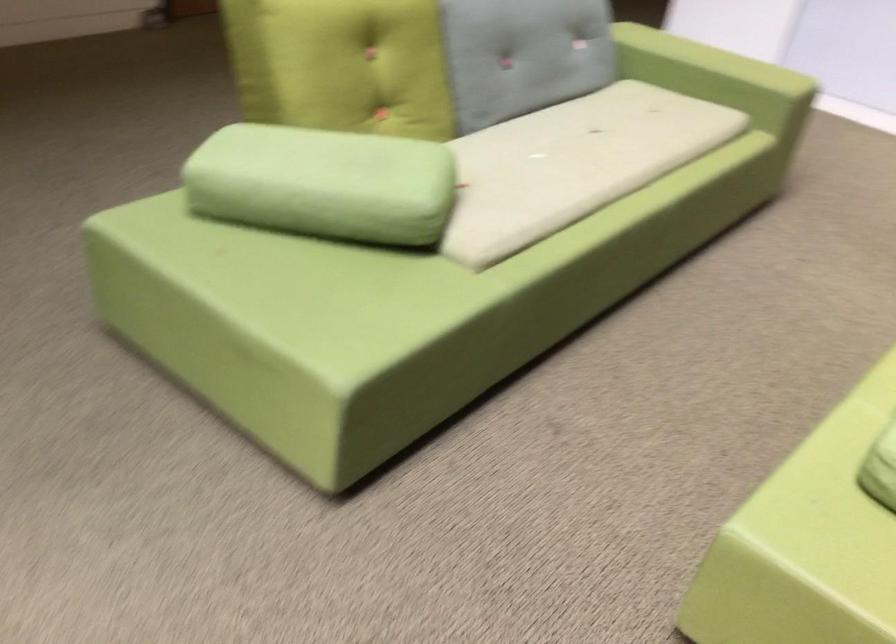
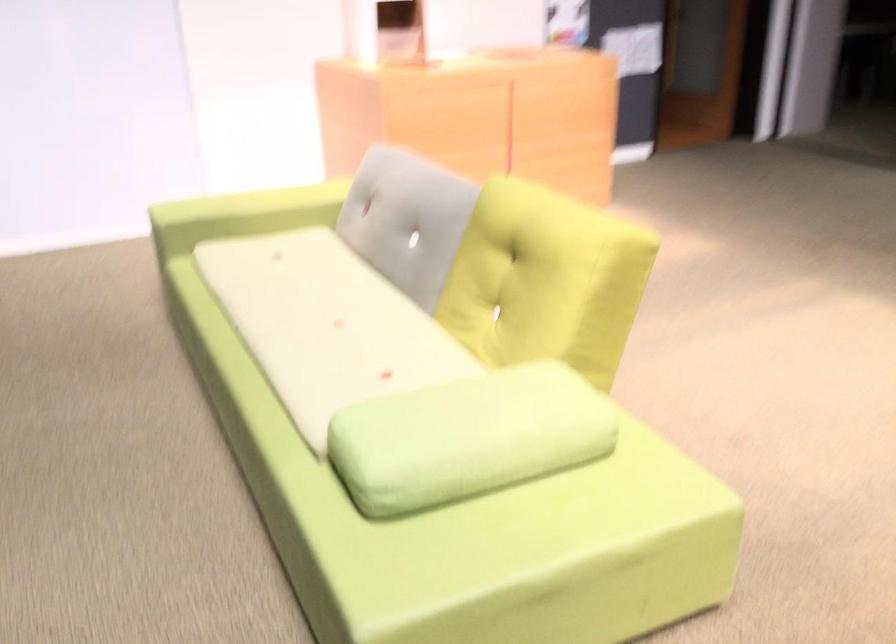
Question: The camera is either moving clockwise (left) or counter-clockwise (right) around the object. The first image is from the beginning of the video and the second image is from the end. Is the camera moving left or right when shooting the video?

Choices:
 (A) Left
 (B) Right

Answer: (A)